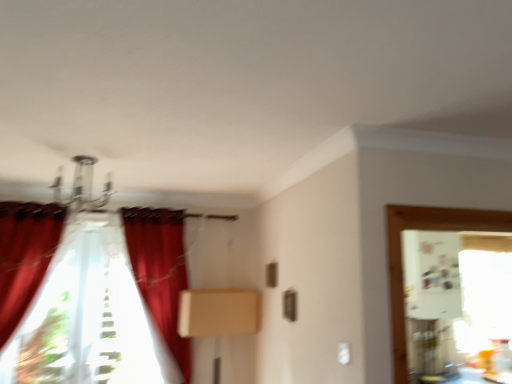
Question: From a real-world perspective, is velvet red curtain at center, which appears as the 3th curtain when viewed from the left, physically located above or below beige cardboard box at center?

Choices:
 (A) above
 (B) below

Answer: (A)

Question: Is velvet red curtain at center, the 1th curtain in the right-to-left sequence, bigger or smaller than beige cardboard box at center?

Choices:
 (A) big
 (B) small

Answer: (A)

Question: Based on their relative distances, which object is farther from the metallic chandelier at upper center?

Choices:
 (A) translucent fabric curtain at left, positioned as the second curtain in right-to-left order
 (B) velvet red curtain at left, acting as the first curtain starting from the left
 (C) velvet red curtain at center, which appears as the 3th curtain when viewed from the left
 (D) beige cardboard box at center

Answer: (D)

Question: Which object is the closest to the velvet red curtain at center, which appears as the 3th curtain when viewed from the left?

Choices:
 (A) velvet red curtain at left, acting as the first curtain starting from the left
 (B) metallic chandelier at upper center
 (C) translucent fabric curtain at left, positioned as the second curtain in right-to-left order
 (D) beige cardboard box at center

Answer: (C)